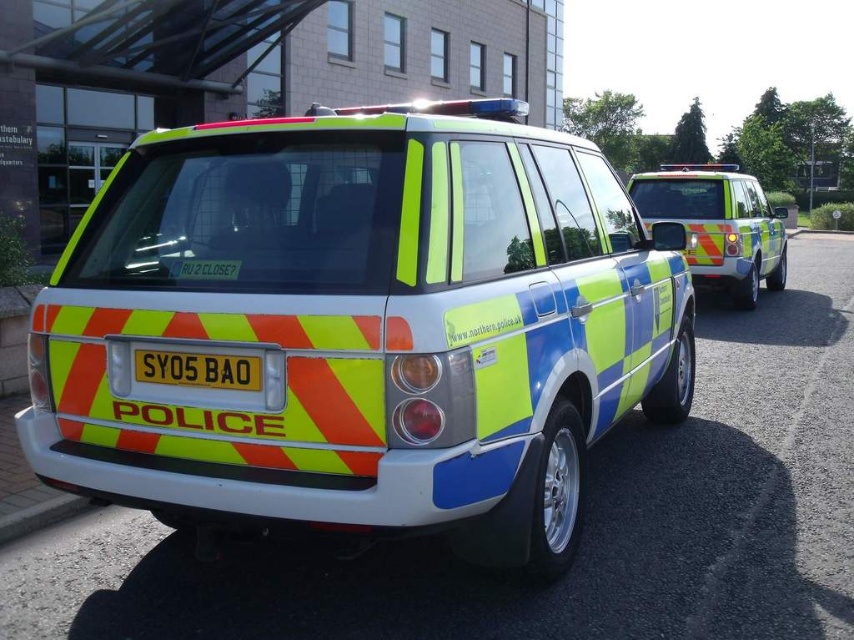
Who is shorter, reflective plastic police car at center or reflective yellow-green suv at center-right?

Standing shorter between the two is reflective plastic police car at center.

Does reflective plastic police car at center come in front of reflective yellow-green suv at center-right?

Yes.

Locate an element on the screen. This screenshot has width=854, height=640. reflective plastic police car at center is located at coordinates (358, 326).